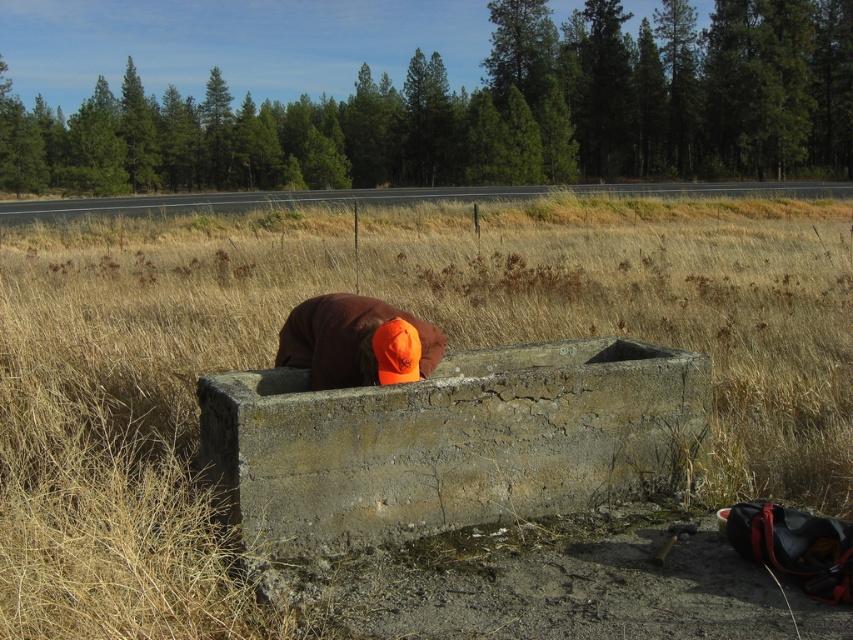
You are a hiker who wants to take a shortcut through the field. You notice the dry grass at center and the brown fuzzy hat at center. Which object is closer to you as you approach the field?

The dry grass at center is closer to you because it is in front of the brown fuzzy hat at center.

You are a worker who needs to place a brown fuzzy hat at center onto the gray concrete trough at center. Based on the size difference between them, will the hat fit entirely on the trough?

The gray concrete trough at center is larger than the brown fuzzy hat at center, so the hat will fit entirely on the trough.

You are a worker who needs to reach the brown fuzzy hat at center from the gray concrete trough at center. Considering the distance between them is less than 20 inches, can you easily grab it without moving your position?

The gray concrete trough at center is 18.83 inches from brown fuzzy hat at center, so yes, you can easily grab the brown fuzzy hat at center without moving since the distance is under 20 inches.